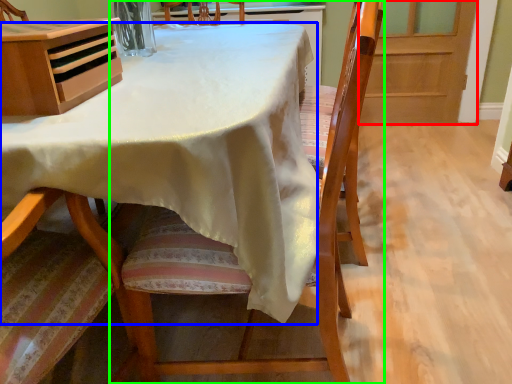
Question: Which object is the farthest from screen door (highlighted by a red box)? Choose among these: table (highlighted by a blue box) or chair (highlighted by a green box).

Choices:
 (A) table
 (B) chair

Answer: (A)